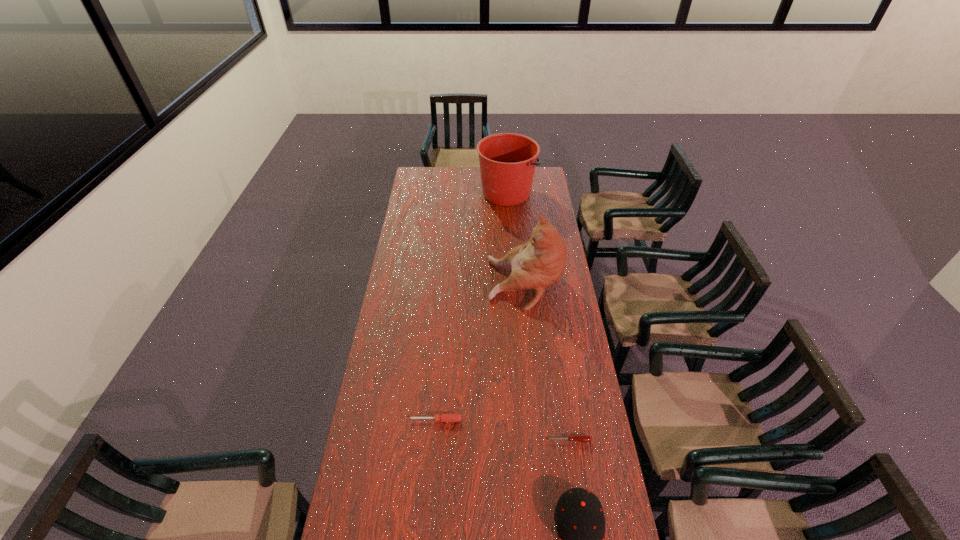
At what (x,y) coordinates should I click in order to perform the action: click on the fourth nearest object. Please return your answer as a coordinate pair (x, y). Looking at the image, I should click on (539, 263).

Find the location of a particular element. The image size is (960, 540). bucket is located at coordinates [507, 161].

What are the coordinates of `the left screwdriver` in the screenshot? It's located at (443, 417).

At what (x,y) coordinates should I click in order to perform the action: click on the leftmost object. Please return your answer as a coordinate pair (x, y). Looking at the image, I should click on (443, 417).

Where is `the second nearest object`? This screenshot has height=540, width=960. the second nearest object is located at coordinates (581, 438).

Where is `the right screwdriver`? The width and height of the screenshot is (960, 540). the right screwdriver is located at coordinates (581, 438).

This screenshot has width=960, height=540. Find the location of `vacant space situated on the face of the fourth nearest object`. vacant space situated on the face of the fourth nearest object is located at coordinates (465, 284).

Where is `free space located on the face of the fourth nearest object`? free space located on the face of the fourth nearest object is located at coordinates (459, 284).

This screenshot has height=540, width=960. Identify the location of vacant space situated on the face of the fourth nearest object. (473, 284).

At what (x,y) coordinates should I click in order to perform the action: click on vacant space situated on the left of the farthest object. Please return your answer as a coordinate pair (x, y). Looking at the image, I should click on (459, 193).